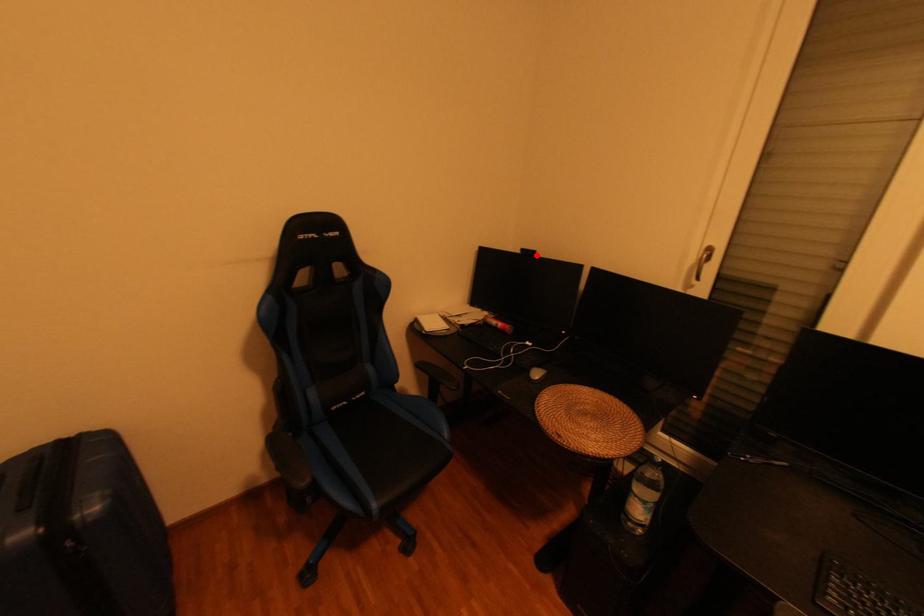
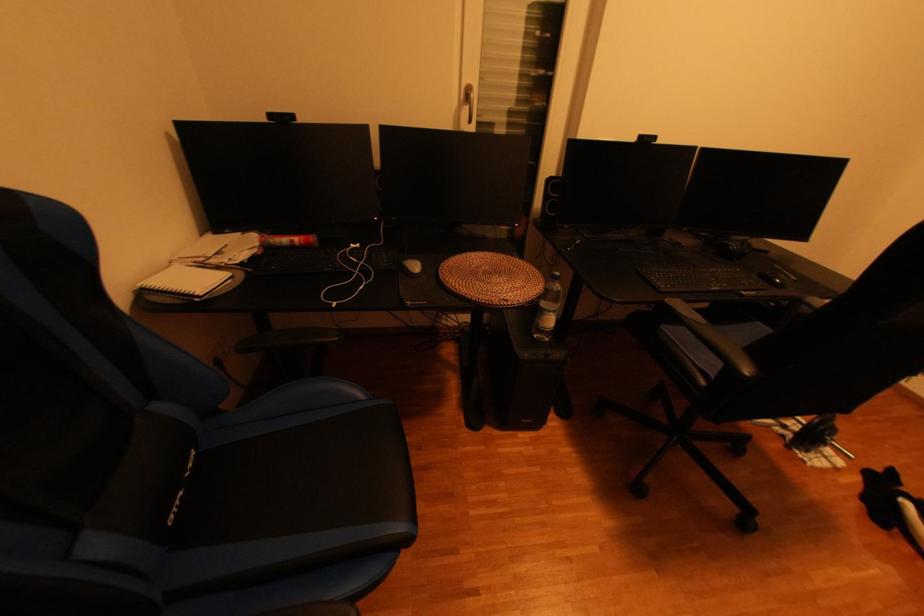
Find the pixel in the second image that matches the highlighted location in the first image.

(294, 121)